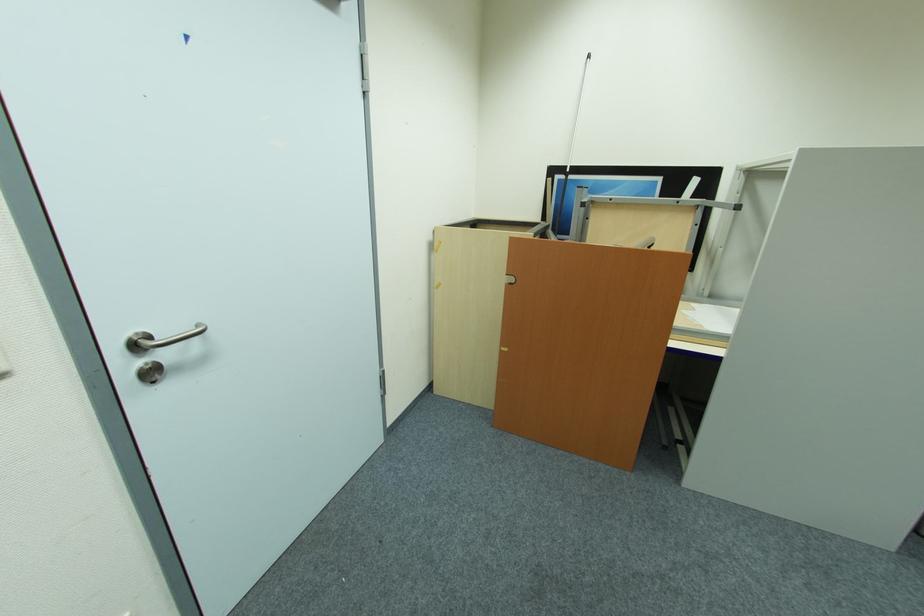
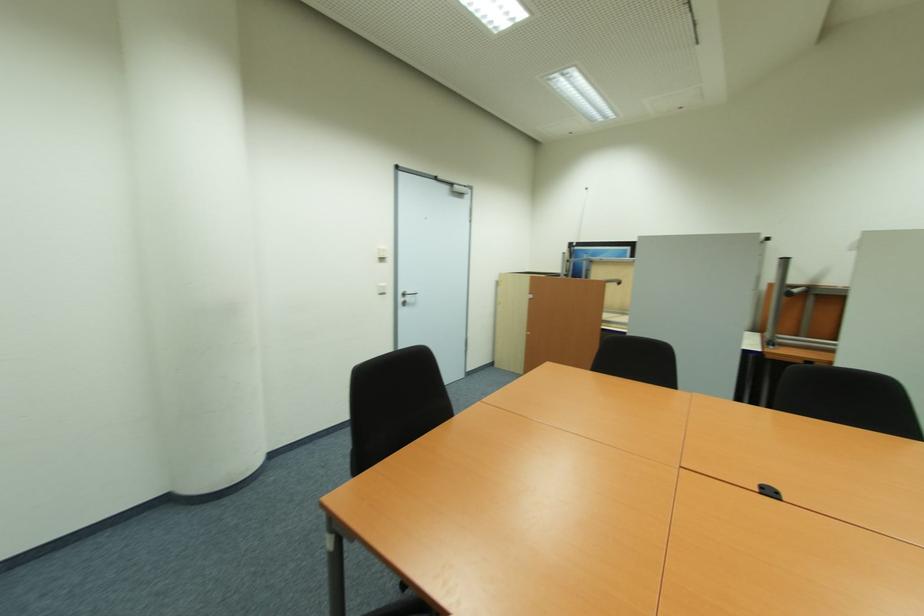
The point at (x=129, y=369) is marked in the first image. Where is the corresponding point in the second image?

(405, 300)